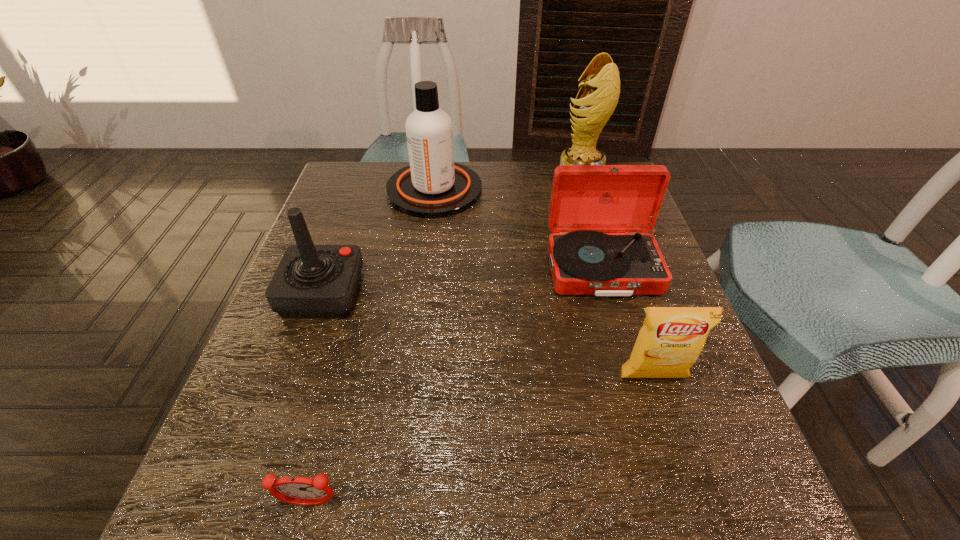
The image size is (960, 540). Find the location of `award`. award is located at coordinates (600, 92).

I want to click on cleansing agent, so click(x=433, y=186).

Image resolution: width=960 pixels, height=540 pixels. Identify the location of joystick. (311, 280).

Identify the location of phonograph_record. pyautogui.click(x=586, y=200).

Identify the location of crisp (potato chip). This screenshot has height=540, width=960. (671, 339).

Where is `the shortest object`? The image size is (960, 540). the shortest object is located at coordinates 296,490.

The height and width of the screenshot is (540, 960). I want to click on alarm clock, so click(296, 490).

This screenshot has width=960, height=540. Find the location of `vacant region located 0.400m on the front-facing side of the award`. vacant region located 0.400m on the front-facing side of the award is located at coordinates (421, 178).

You are a GUI agent. You are given a task and a screenshot of the screen. Output one action in this format:
    pyautogui.click(x=<x>, y=<y>)
    Task: Click on the free space located 0.160m on the front-facing side of the award
    The height and width of the screenshot is (540, 960).
    Given the screenshot: What is the action you would take?
    pyautogui.click(x=503, y=178)

Locate an element on the screen. vacant point located on the front-facing side of the award is located at coordinates (476, 178).